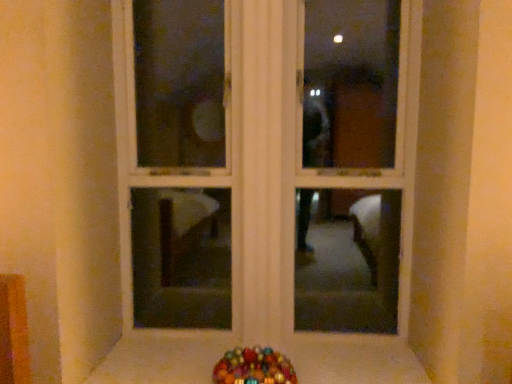
Question: Does white wood window frame at center have a lesser height compared to smooth white surface at lower center?

Choices:
 (A) no
 (B) yes

Answer: (A)

Question: From a real-world perspective, is white wood window frame at center on top of smooth white surface at lower center?

Choices:
 (A) no
 (B) yes

Answer: (B)

Question: Is smooth white surface at lower center surrounded by white wood window frame at center?

Choices:
 (A) no
 (B) yes

Answer: (A)

Question: Is white wood window frame at center taller than smooth white surface at lower center?

Choices:
 (A) yes
 (B) no

Answer: (A)

Question: Does white wood window frame at center touch smooth white surface at lower center?

Choices:
 (A) yes
 (B) no

Answer: (B)

Question: Looking at their shapes, would you say smooth white surface at lower center is wider or thinner than white wood window frame at center?

Choices:
 (A) wide
 (B) thin

Answer: (A)

Question: Does point (205, 372) appear closer or farther from the camera than point (282, 299)?

Choices:
 (A) farther
 (B) closer

Answer: (B)

Question: Based on their positions, is smooth white surface at lower center located to the left or right of white wood window frame at center?

Choices:
 (A) right
 (B) left

Answer: (B)

Question: Is smooth white surface at lower center spatially inside white wood window frame at center, or outside of it?

Choices:
 (A) outside
 (B) inside

Answer: (A)

Question: Is point (247, 347) positioned closer to the camera than point (397, 23)?

Choices:
 (A) farther
 (B) closer

Answer: (B)

Question: Looking at their shapes, would you say glossy plastic candy at lower center is wider or thinner than white wood window frame at center?

Choices:
 (A) wide
 (B) thin

Answer: (A)

Question: Is glossy plastic candy at lower center taller or shorter than white wood window frame at center?

Choices:
 (A) short
 (B) tall

Answer: (A)

Question: From a real-world perspective, is glossy plastic candy at lower center physically located above or below white wood window frame at center?

Choices:
 (A) below
 (B) above

Answer: (A)

Question: Is point (175, 243) positioned closer to the camera than point (138, 334)?

Choices:
 (A) farther
 (B) closer

Answer: (A)

Question: From a real-world perspective, is white wood window frame at center positioned above or below smooth white surface at lower center?

Choices:
 (A) above
 (B) below

Answer: (A)